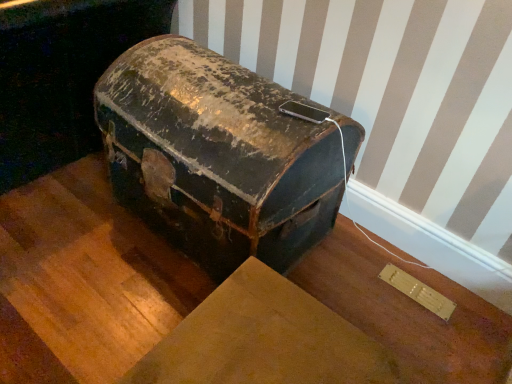
What do you see at coordinates (220, 155) in the screenshot? I see `rusty leather suitcase at center` at bounding box center [220, 155].

Find the location of a particular element. The height and width of the screenshot is (384, 512). rusty leather suitcase at center is located at coordinates (220, 155).

What is the approximate width of rusty metal trunk at center?

37.24 inches.

The width and height of the screenshot is (512, 384). What do you see at coordinates (61, 76) in the screenshot? I see `rusty metal trunk at center` at bounding box center [61, 76].

Image resolution: width=512 pixels, height=384 pixels. I want to click on rusty metal trunk at center, so click(61, 76).

The width and height of the screenshot is (512, 384). I want to click on rusty leather suitcase at center, so click(x=220, y=155).

Which is more to the left, rusty metal trunk at center or rusty leather suitcase at center?

Positioned to the left is rusty metal trunk at center.

Which object is further away from the camera, rusty metal trunk at center or rusty leather suitcase at center?

rusty metal trunk at center is more distant.

Which is in front, point (44, 143) or point (273, 128)?

Positioned in front is point (273, 128).

From the image's perspective, which one is positioned lower, rusty metal trunk at center or rusty leather suitcase at center?

rusty leather suitcase at center, from the image's perspective.

From a real-world perspective, who is located lower, rusty metal trunk at center or rusty leather suitcase at center?

In real-world perspective, rusty leather suitcase at center is lower.

Between rusty metal trunk at center and rusty leather suitcase at center, which one has smaller width?

rusty leather suitcase at center is thinner.

Considering the sizes of objects rusty metal trunk at center and rusty leather suitcase at center in the image provided, who is shorter, rusty metal trunk at center or rusty leather suitcase at center?

rusty leather suitcase at center is shorter.

Is rusty metal trunk at center bigger or smaller than rusty leather suitcase at center?

Clearly, rusty metal trunk at center is larger in size than rusty leather suitcase at center.

Is rusty metal trunk at center surrounding rusty leather suitcase at center?

That's incorrect, rusty leather suitcase at center is not inside rusty metal trunk at center.

Are rusty metal trunk at center and rusty leather suitcase at center far apart?

That's not correct — rusty metal trunk at center is a little close to rusty leather suitcase at center.

Is rusty metal trunk at center turned away from rusty leather suitcase at center?

That's not correct — rusty metal trunk at center is not looking away from rusty leather suitcase at center.

What's the angular difference between rusty metal trunk at center and rusty leather suitcase at center's facing directions?

The angular difference between rusty metal trunk at center and rusty leather suitcase at center is 1.64 degrees.

At what (x,y) coordinates should I click in order to perform the action: click on furniture above the rusty leather suitcase at center (from a real-world perspective). Please return your answer as a coordinate pair (x, y). Looking at the image, I should click on (61, 76).

Can you confirm if rusty leather suitcase at center is positioned to the right of rusty metal trunk at center?

Indeed, rusty leather suitcase at center is positioned on the right side of rusty metal trunk at center.

Is rusty leather suitcase at center further to camera compared to rusty metal trunk at center?

No, it is not.

Is point (170, 177) less distant than point (6, 186)?

Yes.

From the image's perspective, is rusty leather suitcase at center on rusty metal trunk at center?

Actually, rusty leather suitcase at center appears below rusty metal trunk at center in the image.

From a real-world perspective, which object stands above the other?

In real-world perspective, rusty metal trunk at center is above.

Based on the photo, considering the sizes of objects rusty leather suitcase at center and rusty metal trunk at center in the image provided, who is thinner, rusty leather suitcase at center or rusty metal trunk at center?

rusty leather suitcase at center is thinner.

Considering the relative sizes of rusty leather suitcase at center and rusty metal trunk at center in the image provided, is rusty leather suitcase at center taller than rusty metal trunk at center?

No.

Is rusty leather suitcase at center bigger or smaller than rusty metal trunk at center?

In the image, rusty leather suitcase at center appears to be smaller than rusty metal trunk at center.

Would you say rusty leather suitcase at center contains rusty metal trunk at center?

No.

Is rusty leather suitcase at center touching rusty metal trunk at center?

There is a gap between rusty leather suitcase at center and rusty metal trunk at center.

Looking at this image, could you tell me if rusty leather suitcase at center is turned towards rusty metal trunk at center?

No.

How different are the orientations of rusty leather suitcase at center and rusty metal trunk at center in degrees?

1.64 degrees.

What are the coordinates of `furniture above the rusty leather suitcase at center (from the image's perspective)` in the screenshot? It's located at (61, 76).

Locate an element on the screen. suitcase that is below the rusty metal trunk at center (from the image's perspective) is located at coordinates (220, 155).

The width and height of the screenshot is (512, 384). Find the location of `furniture that appears above the rusty leather suitcase at center (from a real-world perspective)`. furniture that appears above the rusty leather suitcase at center (from a real-world perspective) is located at coordinates (61, 76).